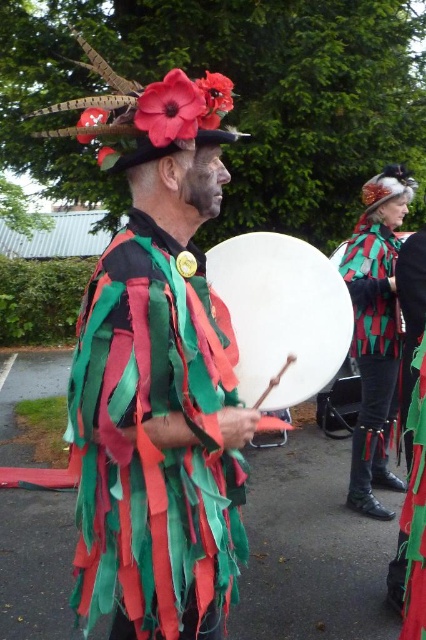
Question: Is white leather drum at center thinner than green textured fabric at center?

Choices:
 (A) no
 (B) yes

Answer: (B)

Question: Which of the following is the closest to the observer?

Choices:
 (A) white leather drum at center
 (B) green textured fabric at center
 (C) textured fabric cape at center

Answer: (C)

Question: Is white leather drum at center to the left of green textured fabric at center from the viewer's perspective?

Choices:
 (A) no
 (B) yes

Answer: (B)

Question: Can you confirm if textured fabric cape at center is smaller than white leather drum at center?

Choices:
 (A) yes
 (B) no

Answer: (B)

Question: Which point is closer to the camera taking this photo?

Choices:
 (A) (138, 572)
 (B) (316, 348)

Answer: (A)

Question: Which object is positioned farthest from the textured fabric cape at center?

Choices:
 (A) green textured fabric at center
 (B) white leather drum at center

Answer: (A)